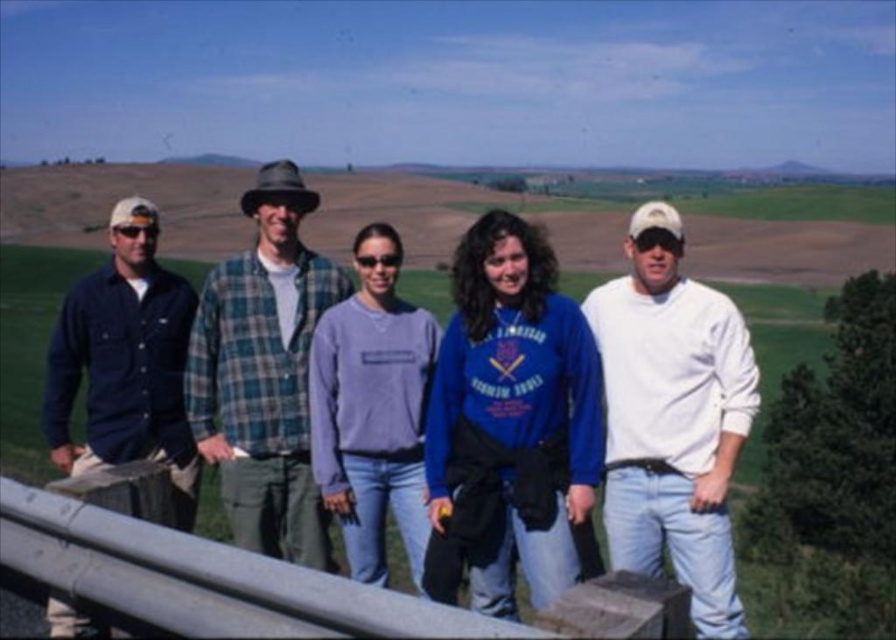
Which is more to the left, blue fleece jacket at center or dark blue flannel shirt at left?

Positioned to the left is dark blue flannel shirt at left.

In order to click on blue fleece jacket at center in this screenshot , I will do `click(511, 424)`.

Does white cotton shirt at center appear under dark blue flannel shirt at left?

Yes, white cotton shirt at center is below dark blue flannel shirt at left.

The width and height of the screenshot is (896, 640). What do you see at coordinates (672, 417) in the screenshot?
I see `white cotton shirt at center` at bounding box center [672, 417].

The image size is (896, 640). I want to click on white cotton shirt at center, so click(672, 417).

Based on the photo, can you confirm if green plaid shirt at center is positioned to the left of dark blue flannel shirt at left?

No, green plaid shirt at center is not to the left of dark blue flannel shirt at left.

Consider the image. Can you confirm if green plaid shirt at center is positioned above dark blue flannel shirt at left?

Indeed, green plaid shirt at center is positioned over dark blue flannel shirt at left.

Is point (257, 372) positioned in front of point (67, 396)?

Yes, it is in front of point (67, 396).

Identify the location of green plaid shirt at center. The width and height of the screenshot is (896, 640). (264, 372).